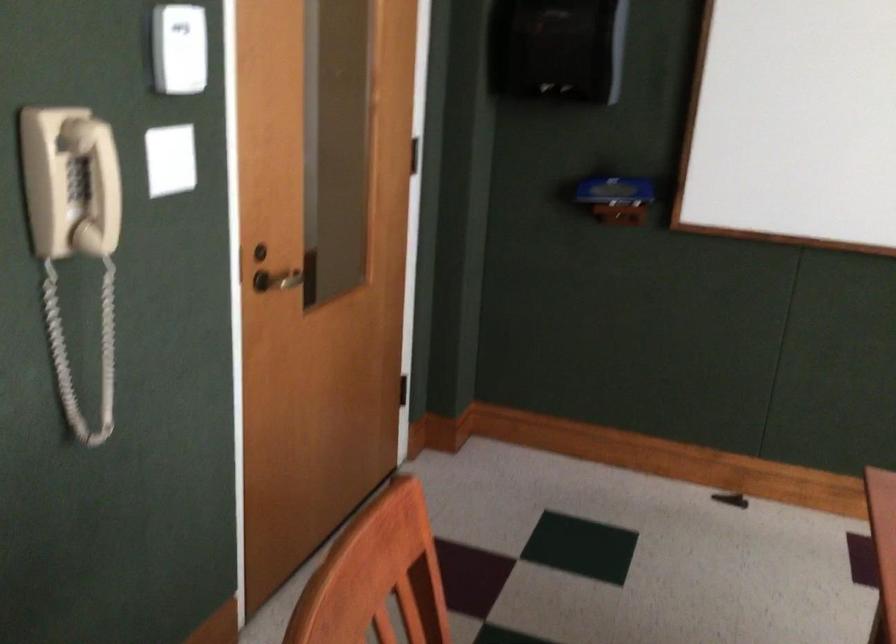
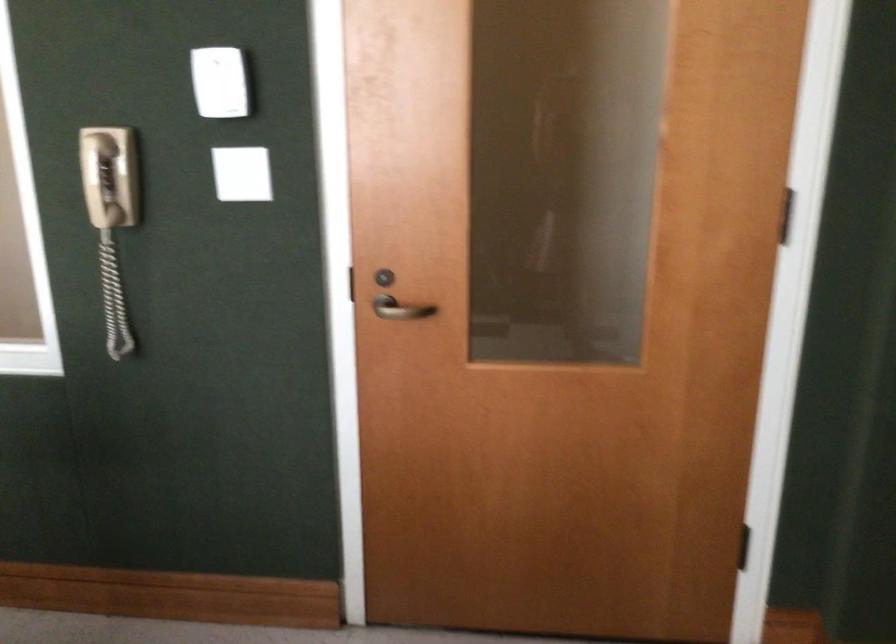
Where in the second image is the point corresponding to point 238,268 from the first image?

(346, 283)